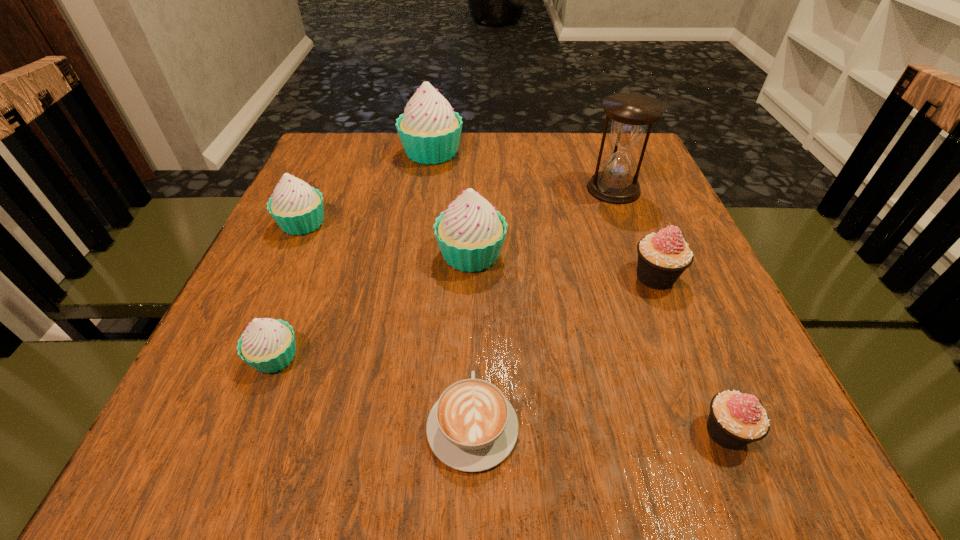
Where is `hourglass`? The image size is (960, 540). hourglass is located at coordinates (631, 113).

What are the coordinates of `the farthest white cupcake` in the screenshot? It's located at (430, 130).

Locate an element on the screen. The image size is (960, 540). the farthest cupcake is located at coordinates (430, 130).

Image resolution: width=960 pixels, height=540 pixels. I want to click on the third smallest white cupcake, so click(x=470, y=234).

Find the location of a particular element. This screenshot has height=540, width=960. the third tallest object is located at coordinates (470, 234).

The width and height of the screenshot is (960, 540). I want to click on the second smallest white cupcake, so click(x=297, y=208).

Identify the location of the bigger pink cupcake. This screenshot has width=960, height=540. (663, 257).

Locate an element on the screen. the fifth farthest cupcake is located at coordinates (268, 345).

Where is `the sixth farthest object`? The height and width of the screenshot is (540, 960). the sixth farthest object is located at coordinates (268, 345).

This screenshot has height=540, width=960. I want to click on the nearest cupcake, so click(736, 419).